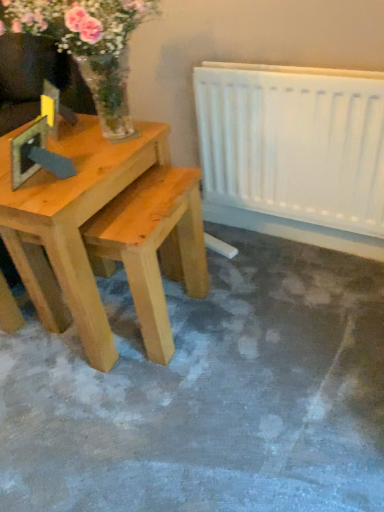
Question: Is translucent glass vase at upper left wider than light brown wood table at left?

Choices:
 (A) no
 (B) yes

Answer: (A)

Question: From the image's perspective, would you say translucent glass vase at upper left is shown under light brown wood table at left?

Choices:
 (A) no
 (B) yes

Answer: (A)

Question: Is translucent glass vase at upper left oriented towards light brown wood table at left?

Choices:
 (A) yes
 (B) no

Answer: (B)

Question: From a real-world perspective, is translucent glass vase at upper left located higher than light brown wood table at left?

Choices:
 (A) no
 (B) yes

Answer: (B)

Question: Is translucent glass vase at upper left positioned beyond the bounds of light brown wood table at left?

Choices:
 (A) no
 (B) yes

Answer: (B)

Question: Would you say translucent glass vase at upper left is to the left or to the right of white plastic radiator at right in the picture?

Choices:
 (A) right
 (B) left

Answer: (B)

Question: From a real-world perspective, is translucent glass vase at upper left above or below white plastic radiator at right?

Choices:
 (A) above
 (B) below

Answer: (A)

Question: From their relative heights in the image, would you say translucent glass vase at upper left is taller or shorter than white plastic radiator at right?

Choices:
 (A) short
 (B) tall

Answer: (A)

Question: In terms of width, does translucent glass vase at upper left look wider or thinner when compared to white plastic radiator at right?

Choices:
 (A) wide
 (B) thin

Answer: (A)

Question: Is point (1, 196) closer or farther from the camera than point (57, 44)?

Choices:
 (A) closer
 (B) farther

Answer: (A)

Question: Considering the relative positions of light brown wood table at left and translucent glass vase at upper left in the image provided, is light brown wood table at left to the left or to the right of translucent glass vase at upper left?

Choices:
 (A) left
 (B) right

Answer: (A)

Question: Is light brown wood table at left wider or thinner than translucent glass vase at upper left?

Choices:
 (A) thin
 (B) wide

Answer: (B)

Question: From the image's perspective, is light brown wood table at left above or below translucent glass vase at upper left?

Choices:
 (A) below
 (B) above

Answer: (A)

Question: From the image's perspective, relative to light brown wood table at left, is white plastic radiator at right above or below?

Choices:
 (A) below
 (B) above

Answer: (B)

Question: Considering the relative positions of white plastic radiator at right and light brown wood table at left in the image provided, is white plastic radiator at right to the left or to the right of light brown wood table at left?

Choices:
 (A) right
 (B) left

Answer: (A)